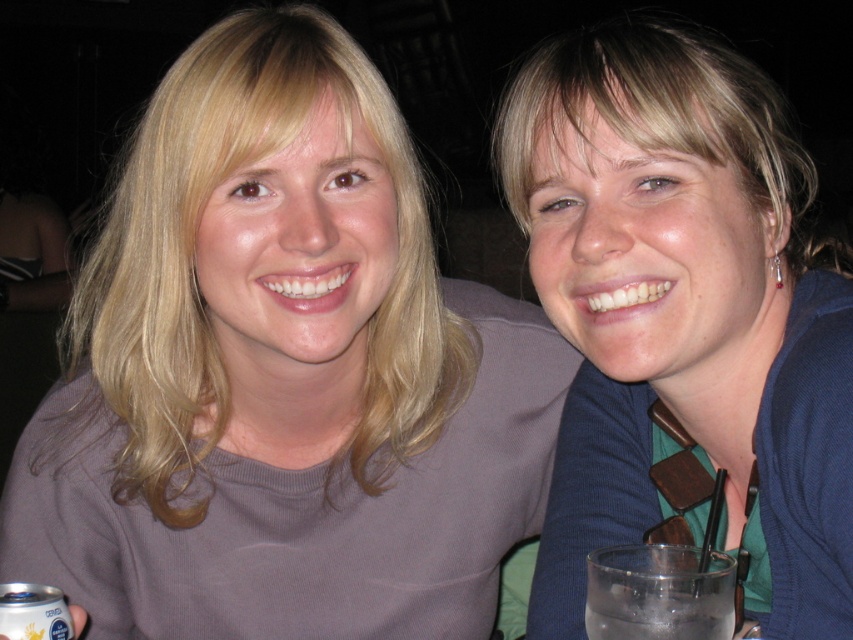
Question: Which is nearer to the blue fabric shirt at upper right?

Choices:
 (A) clear glass at lower right
 (B) matte gray sweater at upper left

Answer: (B)

Question: Can you confirm if matte gray sweater at upper left is thinner than clear glass at lower right?

Choices:
 (A) no
 (B) yes

Answer: (A)

Question: Among these objects, which one is nearest to the camera?

Choices:
 (A) matte gray sweater at upper left
 (B) blue fabric shirt at upper right

Answer: (B)

Question: Does matte gray sweater at upper left have a larger size compared to clear glass at lower right?

Choices:
 (A) no
 (B) yes

Answer: (B)

Question: Is blue fabric shirt at upper right positioned in front of clear glass at lower right?

Choices:
 (A) no
 (B) yes

Answer: (A)

Question: Which of the following is the closest to the observer?

Choices:
 (A) (590, 632)
 (B) (769, 605)
 (C) (335, 474)

Answer: (A)